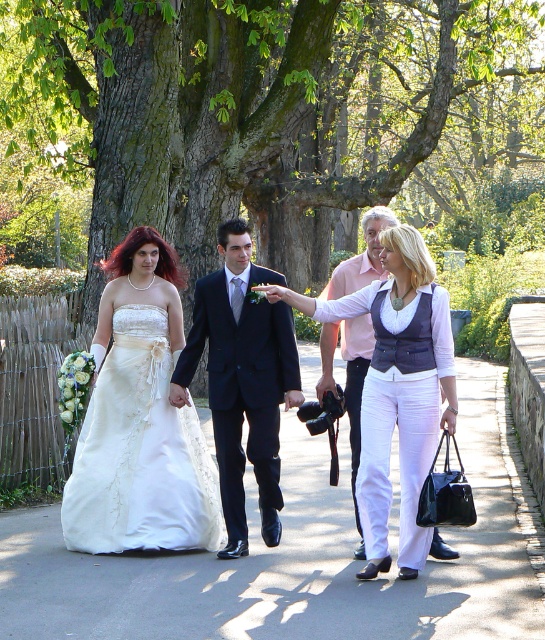
Who is positioned more to the left, ivory satin dress at left or satin white dress at center?

ivory satin dress at left is more to the left.

In the scene shown: Can you confirm if ivory satin dress at left is smaller than satin white dress at center?

Yes.

Where is `ivory satin dress at left`? This screenshot has width=545, height=640. ivory satin dress at left is located at coordinates point(140,452).

This screenshot has width=545, height=640. What do you see at coordinates (292, 561) in the screenshot?
I see `white satin dress at center` at bounding box center [292, 561].

Looking at this image, is white satin dress at center above light pink fabric shirt at center?

No.

Is point (111, 586) positioned in front of point (354, 433)?

That is True.

Find the location of a particular element. white satin dress at center is located at coordinates (292, 561).

Between satin white dress at center and light pink fabric shirt at center, which one appears on the left side from the viewer's perspective?

satin white dress at center

Image resolution: width=545 pixels, height=640 pixels. I want to click on satin white dress at center, so click(x=396, y=388).